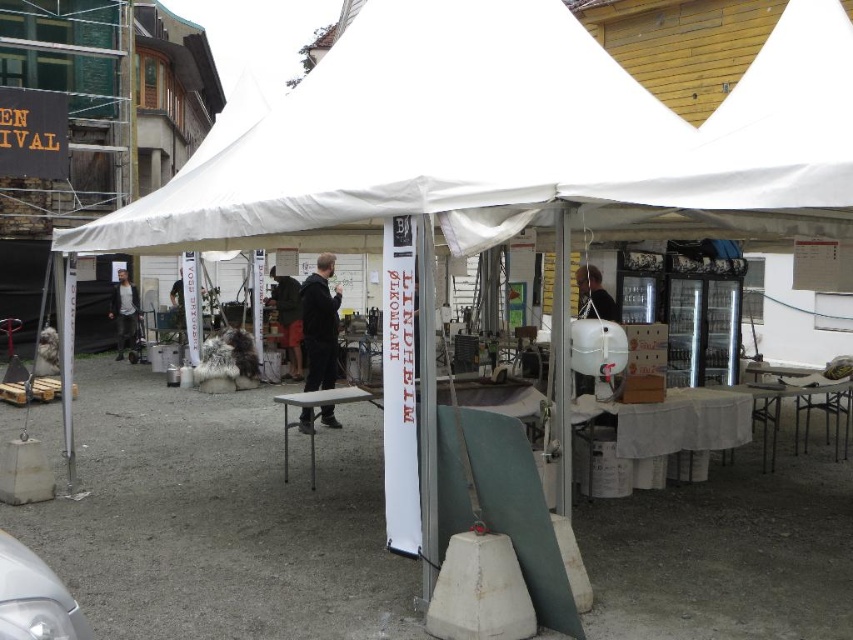
Consider the image. You are standing at the entrance of the tent and see the white fabric canopy at upper center and the dark brown leather jacket at center. Which object is positioned more to the right side of the scene?

The white fabric canopy at upper center is positioned more to the right side of the scene compared to the dark brown leather jacket at center.